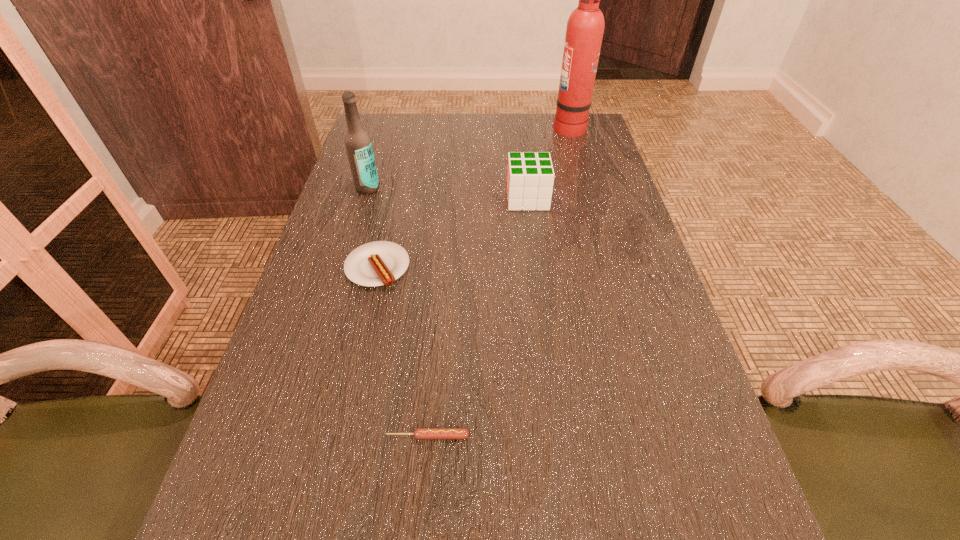
What are the coordinates of `the tallest object` in the screenshot? It's located at 585,27.

This screenshot has height=540, width=960. I want to click on the rightmost object, so click(585, 27).

The width and height of the screenshot is (960, 540). I want to click on the second tallest object, so tap(358, 144).

You are a GUI agent. You are given a task and a screenshot of the screen. Output one action in this format:
    pyautogui.click(x=<x>, y=<y>)
    Task: Click on the third shortest object
    
    Given the screenshot: What is the action you would take?
    [530, 176]

The width and height of the screenshot is (960, 540). I want to click on the second object from right to left, so click(530, 176).

What are the coordinates of `the left sausage` in the screenshot? It's located at (378, 263).

Locate an element on the screen. The height and width of the screenshot is (540, 960). the second shortest object is located at coordinates click(378, 263).

The height and width of the screenshot is (540, 960). Find the location of `the nearer sausage`. the nearer sausage is located at coordinates (420, 433).

Identify the location of the third object from right to left. (420, 433).

The height and width of the screenshot is (540, 960). What are the coordinates of `vacant space located 0.180m on the label side of the tallest object` in the screenshot? It's located at (497, 126).